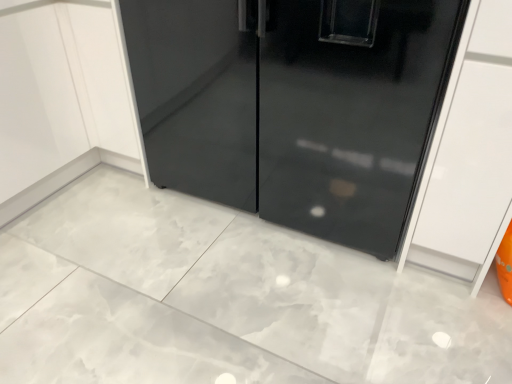
Describe the element at coordinates (347, 111) in the screenshot. I see `glossy black refrigerator at center` at that location.

At what (x,y) coordinates should I click in order to perform the action: click on glossy black refrigerator at center. Please return your answer as a coordinate pair (x, y). The image size is (512, 384). Looking at the image, I should click on (347, 111).

Locate an element on the screen. glossy black refrigerator at center is located at coordinates (347, 111).